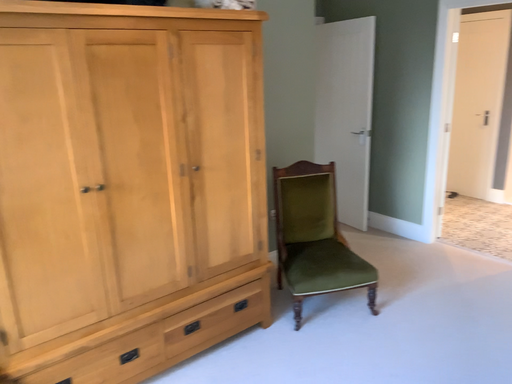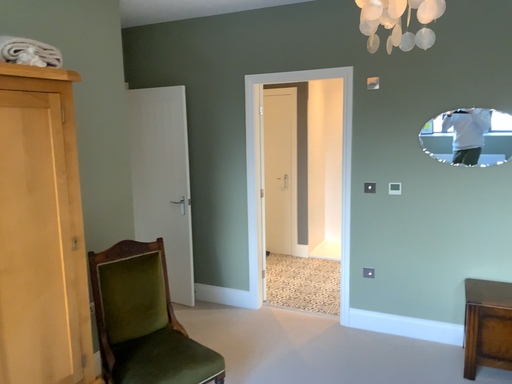
Question: Which way did the camera rotate in the video?

Choices:
 (A) rotated upward
 (B) rotated downward

Answer: (A)